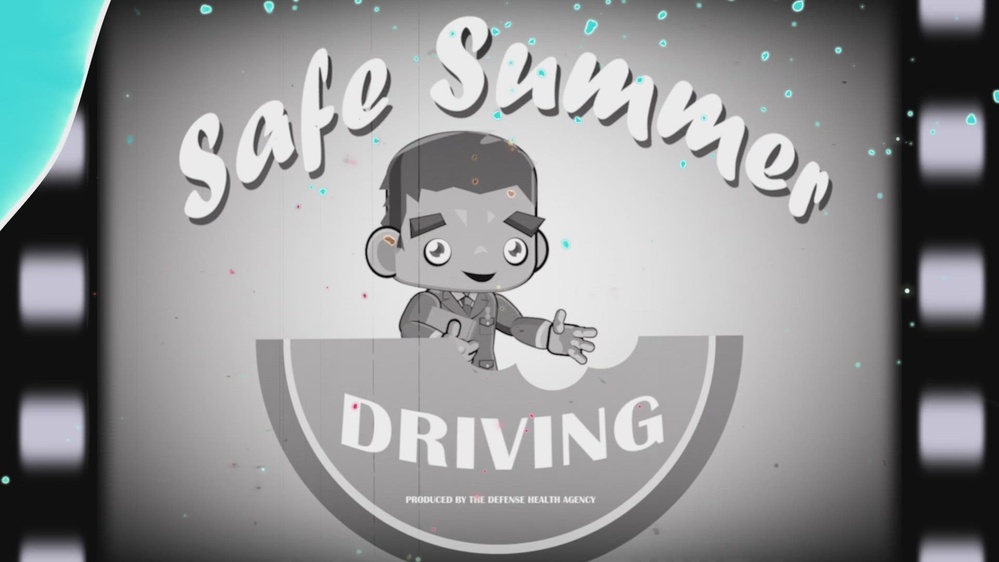
Identify the location of book. The image size is (999, 562). (440, 326).